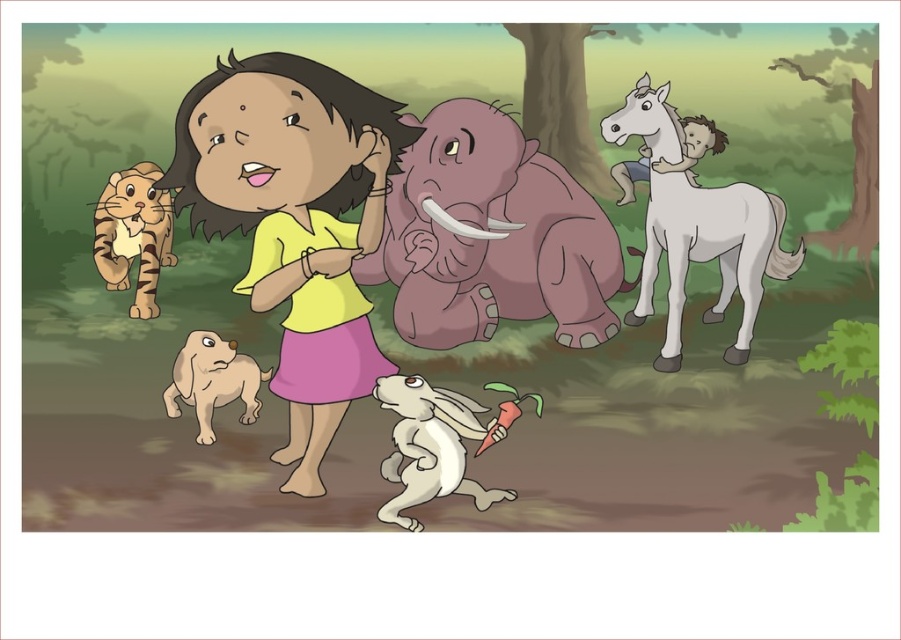
Please provide the coordinates of the purple matte elephant at center in the image. The coordinates should be in the format of a point with two decimal places, like point [492,237]. The image is divided into a grid from 0 to 1 in both x and y axes. The origin is at the bottom left corner. The x axis increases to the right and the y axis increases upward. The girl is at point 0.5, 0.5. The white rabbit is at point 0.6, 0.6. The tiger cub is at point 0.4, 0.4. The dog is at point 0.6, 0.4. The baby purple

The purple matte elephant at center is located at point [492,237].

You are a photographer trying to capture a photo of the purple matte elephant at center and the white matte rabbit at lower center. Based on their heights, which one should you focus on first to ensure both are in frame?

The purple matte elephant at center is taller than the white matte rabbit at lower center. To ensure both are in frame, focus on the taller purple matte elephant at center first, then adjust to include the shorter rabbit.